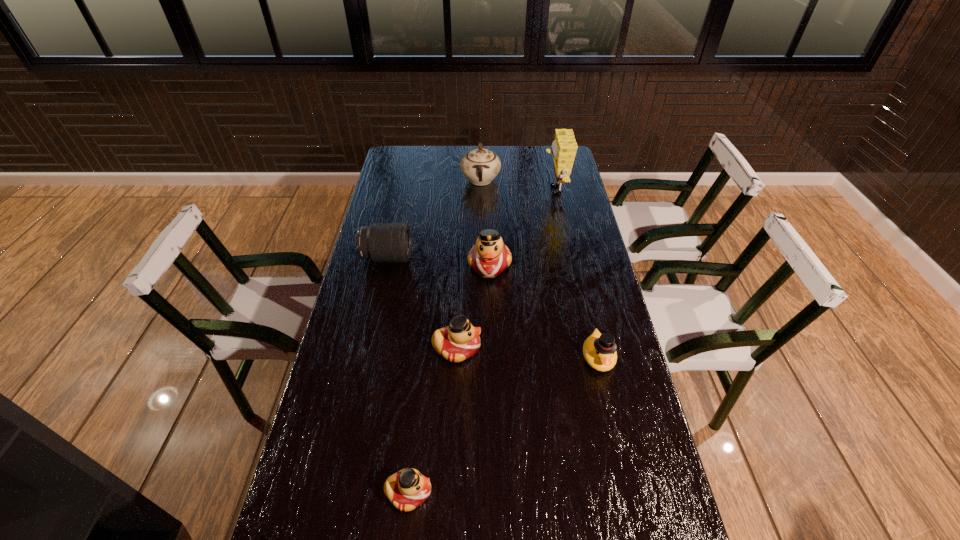
Identify the location of sponge positioned at the far edge. The width and height of the screenshot is (960, 540). (564, 146).

You are a GUI agent. You are given a task and a screenshot of the screen. Output one action in this format:
    pyautogui.click(x=<x>, y=<y>)
    Task: Click on the chinaware that is positioned at the far edge
    Image resolution: width=960 pixels, height=540 pixels.
    Given the screenshot: What is the action you would take?
    pyautogui.click(x=480, y=166)

You are a GUI agent. You are given a task and a screenshot of the screen. Output one action in this format:
    pyautogui.click(x=<x>, y=<y>)
    Task: Click on the object at the left edge
    
    Given the screenshot: What is the action you would take?
    pyautogui.click(x=380, y=242)

At what (x,y) coordinates should I click in order to perform the action: click on sponge that is at the right edge. Please return your answer as a coordinate pair (x, y). Looking at the image, I should click on (564, 146).

Where is `duck positioned at the right edge`? duck positioned at the right edge is located at coordinates (599, 350).

In order to click on object that is at the far right corner in this screenshot , I will do `click(564, 146)`.

Find the location of a particular element. This screenshot has width=960, height=540. vacant area at the far edge of the desktop is located at coordinates (523, 151).

Identify the location of blank space at the left edge. (339, 380).

Find the location of `vacant region at the right edge of the desktop`. vacant region at the right edge of the desktop is located at coordinates (636, 436).

Locate an element on the screen. The image size is (960, 540). free space between the yellow duck and the telephoto lens is located at coordinates (492, 307).